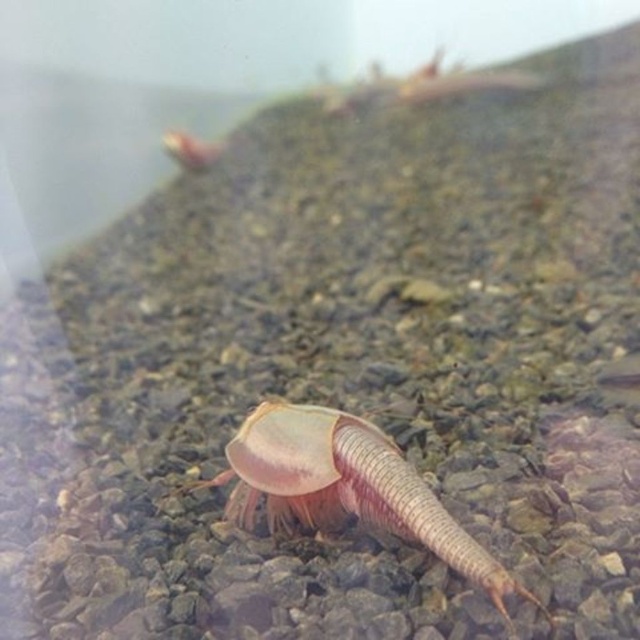
You are a researcher holding a measuring tape. You want to measure the distance between yourself and the translucent pink exoskeleton at center. Can you do it without moving your position?

The translucent pink exoskeleton at center and viewer are 1.07 meters apart, so yes, you can measure the distance using the measuring tape without moving your position as the distance is already known.

You are an aquatic biologist examining an aquarium tank. You notice the translucent pink exoskeleton at center and the translucent pink shrimp at upper left. Which of these two objects is bigger in size?

The translucent pink exoskeleton at center is larger in size than the translucent pink shrimp at upper left.

You are an aquarium keeper who notices two translucent pink creatures in the tank. One is the translucent pink exoskeleton at center and the other is the translucent pink shrimp at upper left. Which one is positioned to the right of the other?

The translucent pink exoskeleton at center is positioned to the right of the translucent pink shrimp at upper left.